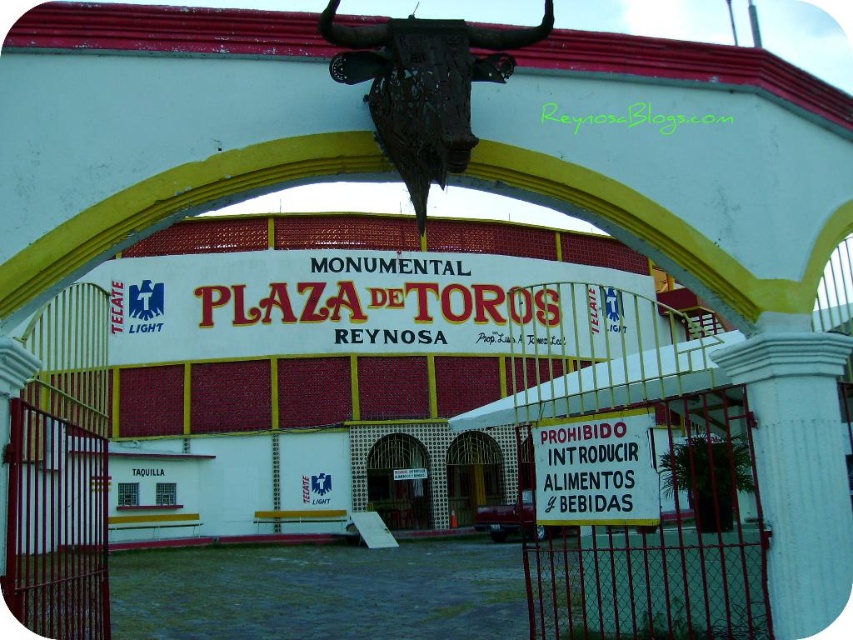
Question: Where is rusty metal bull head at center located in relation to white paper sign at center in the image?

Choices:
 (A) right
 (B) left

Answer: (B)

Question: Among these objects, which one is nearest to the camera?

Choices:
 (A) metallic gate at center
 (B) rusty metal bull head at center
 (C) white metal gate at center
 (D) white paper sign at center

Answer: (B)

Question: Does metallic gate at center appear over white metal gate at center?

Choices:
 (A) no
 (B) yes

Answer: (B)

Question: Which object appears closest to the camera in this image?

Choices:
 (A) white metal gate at center
 (B) metallic gate at center
 (C) rusty metal bull head at center
 (D) white paper sign at center

Answer: (C)

Question: Which point is closer to the camera?

Choices:
 (A) white metal gate at center
 (B) rusty metal bull head at center
 (C) white paper sign at center
 (D) metallic gate at center

Answer: (B)

Question: In this image, where is rusty metal bull head at center located relative to white paper sign at center?

Choices:
 (A) right
 (B) left

Answer: (B)